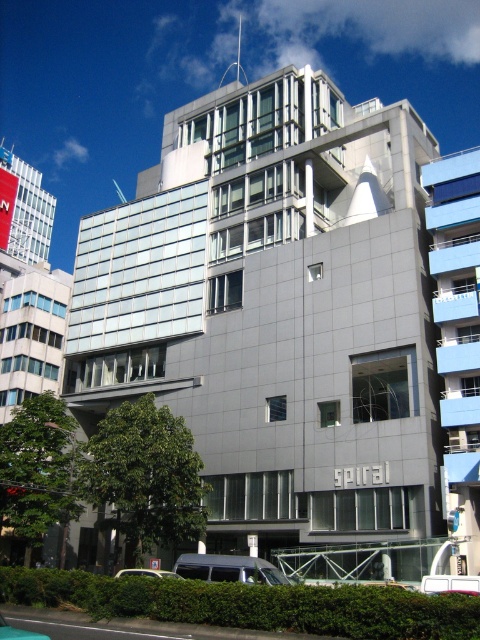
Does silver metallic van at center come behind white matte van at lower center?

No.

In the scene shown: Between silver metallic van at center and white matte van at lower center, which one has less height?

silver metallic van at center is shorter.

Where is `silver metallic van at center`? silver metallic van at center is located at coordinates (228, 568).

Is silver metallic van at center closer to the viewer compared to metallic silver van at lower left?

No, silver metallic van at center is further to the viewer.

Is silver metallic van at center smaller than metallic silver van at lower left?

No.

Does point (266, 570) lie behind point (3, 632)?

Yes, point (266, 570) is farther from viewer.

The height and width of the screenshot is (640, 480). What are the coordinates of `silver metallic van at center` in the screenshot? It's located at (228, 568).

Between metallic silver van at lower left and white matte van at lower center, which one is positioned lower?

Positioned lower is white matte van at lower center.

This screenshot has height=640, width=480. Find the location of `metallic silver van at lower left`. metallic silver van at lower left is located at coordinates (17, 632).